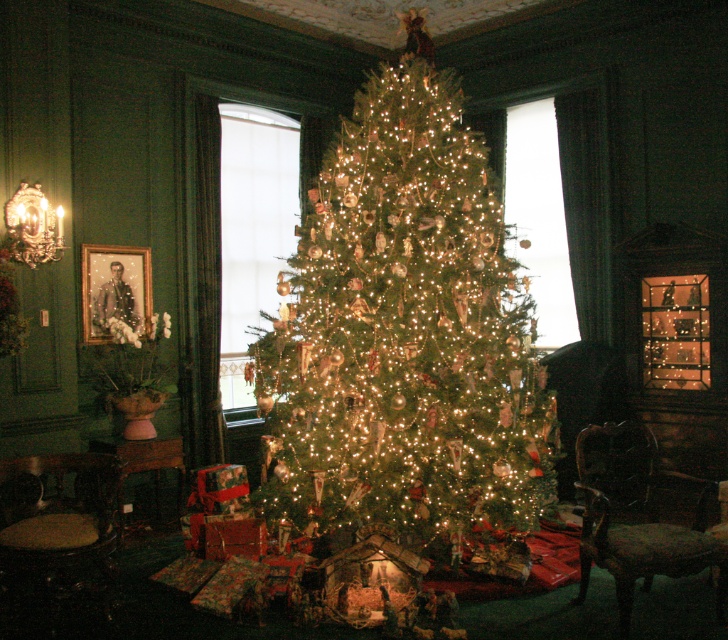
You are a guest entering the room and want to sit in one of the armchairs. The wooden armchair at lower right and the dark brown leather armchair at lower left are both available. If you prefer a wider seat, which armchair should you choose?

The wooden armchair at lower right is wider than the dark brown leather armchair at lower left, so you should choose the wooden armchair at lower right for a wider seat.

You are standing in the room and want to take a photo of both the point at coordinates (521, 531) and the point at coordinates (598, 563). Which point should you focus on first to ensure both are in focus?

You should focus on point (521, 531) first because it is closer to the camera than point (598, 563). This way, both points will be within the depth of field and in focus.

Consider the image. You are standing in the room and want to reach both the point at coordinates (379,360) and the point at (31,573). Which point will you reach first as you move forward?

You will reach point (31,573) first because it is closer to you than point (379,360), which is further away.